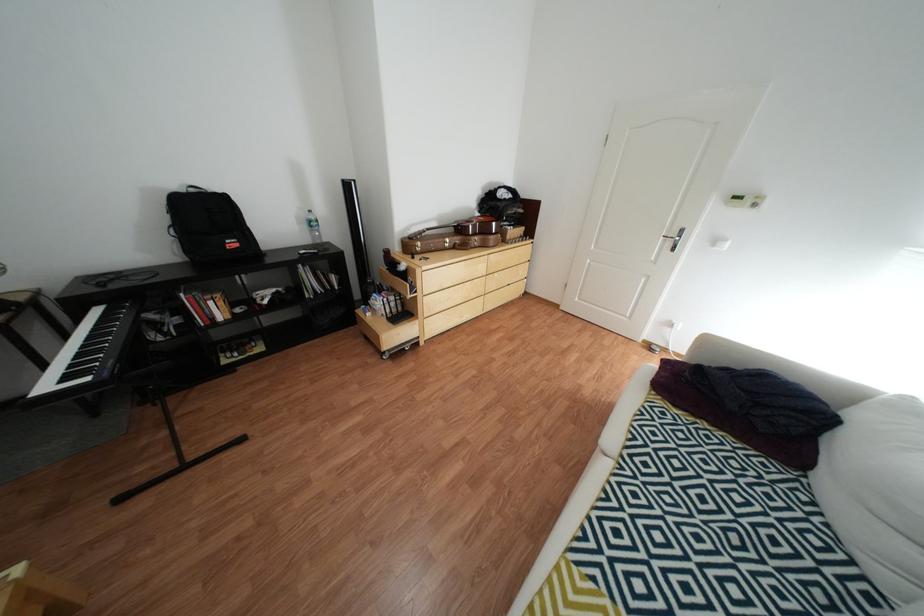
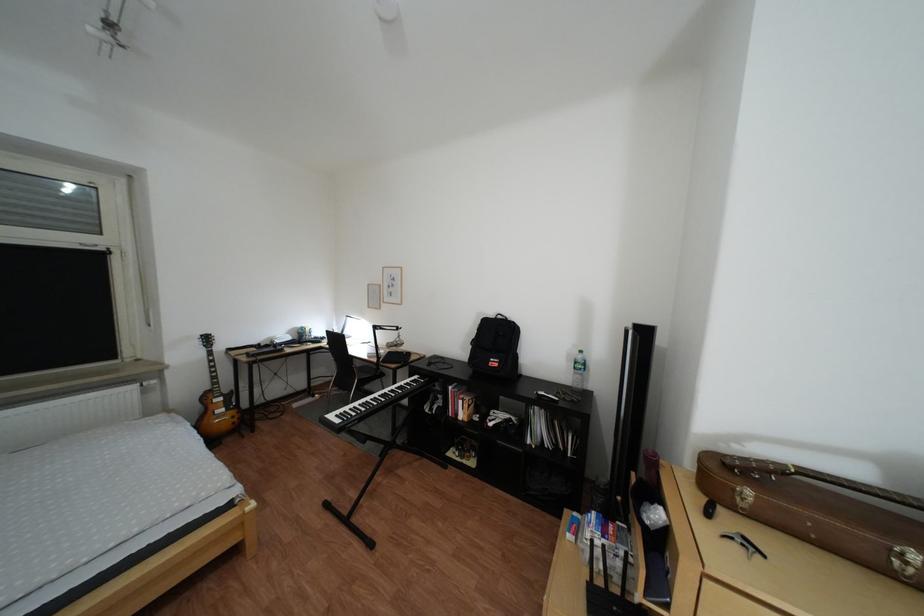
Find the pixel in the second image that matches point 248,245 in the first image.

(509, 363)